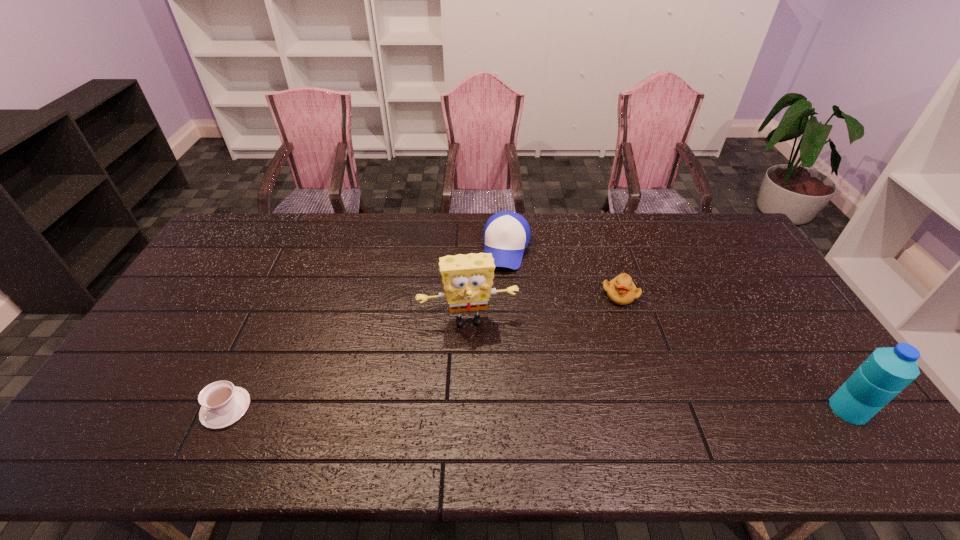
Find the location of `unoccupied position between the fourth tallest object and the teacup`. unoccupied position between the fourth tallest object and the teacup is located at coordinates (422, 352).

Image resolution: width=960 pixels, height=540 pixels. I want to click on empty space that is in between the third tallest object and the shortest object, so click(x=367, y=328).

Point out which object is positioned as the fourth nearest to the second shortest object. Please provide its 2D coordinates. Your answer should be formatted as a tuple, i.e. [(x, y)], where the tuple contains the x and y coordinates of a point satisfying the conditions above.

[(222, 404)]

At what (x,y) coordinates should I click in order to perform the action: click on the closest object to the water bottle. Please return your answer as a coordinate pair (x, y). This screenshot has width=960, height=540. Looking at the image, I should click on (621, 290).

Locate an element on the screen. free space that satisfies the following two spatial constraints: 1. on the front side of the second object from right to left; 2. on the left side of the water bottle is located at coordinates (657, 409).

Find the location of a particular element. vacant region that satisfies the following two spatial constraints: 1. on the front side of the third tallest object; 2. on the left side of the water bottle is located at coordinates (518, 409).